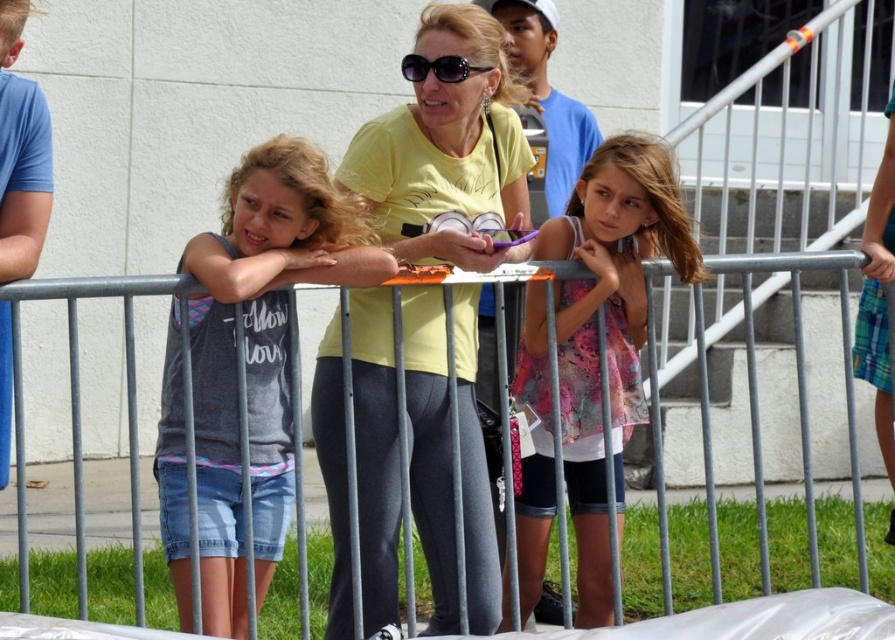
Question: Among these points, which one is nearest to the camera?

Choices:
 (A) (436, 68)
 (B) (586, 342)

Answer: (A)

Question: Which point is closer to the camera?

Choices:
 (A) (427, 524)
 (B) (567, 438)
 (C) (408, 67)

Answer: (C)

Question: Does yellow matte t-shirt at center have a greater width compared to metallic gray fence at center?

Choices:
 (A) yes
 (B) no

Answer: (A)

Question: Based on their relative distances, which object is farther from the black plastic sunglasses at center?

Choices:
 (A) denim shorts at center
 (B) printed fabric dress at center
 (C) yellow matte t-shirt at center
 (D) metallic gray fence at center

Answer: (B)

Question: Where is printed fabric dress at center located in relation to black plastic sunglasses at center in the image?

Choices:
 (A) left
 (B) right

Answer: (B)

Question: Is denim shorts at center above black plastic sunglasses at center?

Choices:
 (A) no
 (B) yes

Answer: (A)